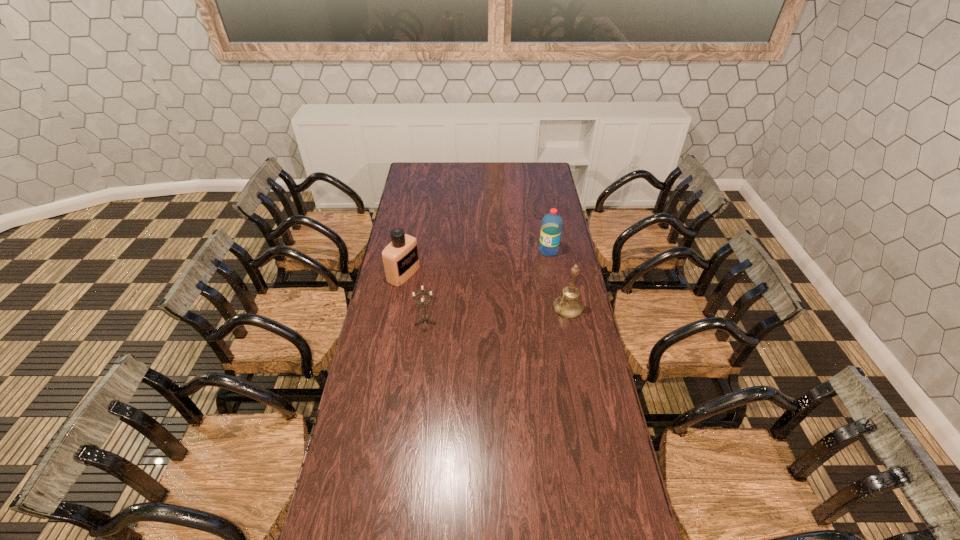
Locate an element on the screen. The width and height of the screenshot is (960, 540). free region at the near left corner is located at coordinates (348, 524).

Identify the location of vacant space at the far right corner of the desktop. (547, 178).

I want to click on free space that is in between the water bottle and the leftmost object, so click(x=476, y=262).

You are a GUI agent. You are given a task and a screenshot of the screen. Output one action in this format:
    pyautogui.click(x=<x>, y=<y>)
    Task: Click on the unoccupied area between the water bottle and the candle holder
    
    Given the screenshot: What is the action you would take?
    pyautogui.click(x=487, y=286)

Locate an element on the screen. free point between the perfume and the water bottle is located at coordinates [x=476, y=262].

Where is `empty space that is in between the third object from right to left and the bell`? The height and width of the screenshot is (540, 960). empty space that is in between the third object from right to left and the bell is located at coordinates (497, 314).

Locate an element on the screen. vacant space that is in between the farthest object and the bell is located at coordinates (559, 279).

You are a GUI agent. You are given a task and a screenshot of the screen. Output one action in this format:
    pyautogui.click(x=<x>, y=<y>)
    Task: Click on the vacant space that is in between the second object from left to right and the farthest object
    
    Given the screenshot: What is the action you would take?
    click(x=487, y=286)

Where is `vacant region between the bell and the candle holder`? vacant region between the bell and the candle holder is located at coordinates (497, 314).

The height and width of the screenshot is (540, 960). I want to click on free point between the shortest object and the farthest object, so click(x=487, y=286).